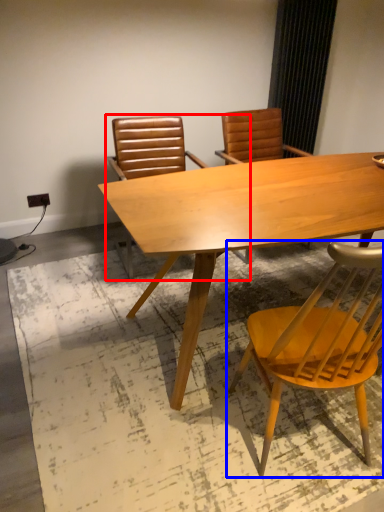
Question: Which object is closer to the camera taking this photo, chair (highlighted by a red box) or chair (highlighted by a blue box)?

Choices:
 (A) chair
 (B) chair

Answer: (B)